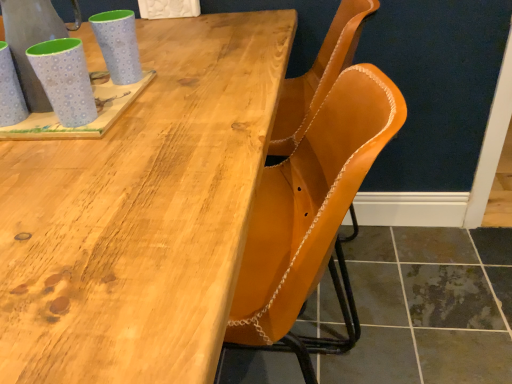
Identify the location of brushed metal pitcher at upper left. Image resolution: width=512 pixels, height=384 pixels. (33, 40).

What do you see at coordinates (311, 216) in the screenshot? The height and width of the screenshot is (384, 512). I see `leather at center` at bounding box center [311, 216].

At what (x,y) coordinates should I click in order to perform the action: click on matte blue mug at upper left, the 2th mug positioned from the right. Please return your answer as a coordinate pair (x, y). The width and height of the screenshot is (512, 384). Looking at the image, I should click on (65, 79).

In order to face matte blue mug at upper left, which ranks as the 1th mug in right-to-left order, should I rotate leftwards or rightwards?

You should look left and rotate roughly 17.838 degrees.

You are a GUI agent. You are given a task and a screenshot of the screen. Output one action in this format:
    pyautogui.click(x=<x>, y=<y>)
    Task: Click on the matte blue mug at left, acting as the 1th mug starting from the left
    This screenshot has height=384, width=512.
    Given the screenshot: What is the action you would take?
    tap(10, 91)

Locate an element on the screen. Image resolution: width=512 pixels, height=384 pixels. natural wood table at upper center is located at coordinates (142, 213).

Describe the element at coordinates (142, 213) in the screenshot. I see `natural wood table at upper center` at that location.

Identify the location of brushed metal pitcher at upper left. (33, 40).

Which of these two, matte blue mug at left, acting as the 1th mug starting from the left, or matte blue mug at upper left, the 2th mug positioned from the right, is wider?

With larger width is matte blue mug at left, acting as the 1th mug starting from the left.

From the image's perspective, which is above, matte blue mug at left, acting as the third mug starting from the right, or matte blue mug at upper left, the 2th mug positioned from the right?

From the image's view, matte blue mug at left, acting as the third mug starting from the right, is above.

Considering their positions, is matte blue mug at left, acting as the third mug starting from the right, located in front of or behind matte blue mug at upper left, marked as the second mug in a left-to-right arrangement?

Visually, matte blue mug at left, acting as the third mug starting from the right, is located behind matte blue mug at upper left, marked as the second mug in a left-to-right arrangement.

This screenshot has width=512, height=384. Find the location of `mug on the right of matte blue mug at upper left, the 2th mug positioned from the right`. mug on the right of matte blue mug at upper left, the 2th mug positioned from the right is located at coordinates (118, 44).

From the image's perspective, does matte blue mug at upper left, which is the 3th mug in left-to-right order, appear higher than matte blue mug at upper left, the 2th mug positioned from the right?

Yes, from the image's perspective, matte blue mug at upper left, which is the 3th mug in left-to-right order, is over matte blue mug at upper left, the 2th mug positioned from the right.

Considering the relative sizes of matte blue mug at upper left, which ranks as the 1th mug in right-to-left order, and matte blue mug at upper left, the 2th mug positioned from the right, in the image provided, is matte blue mug at upper left, which ranks as the 1th mug in right-to-left order, bigger than matte blue mug at upper left, the 2th mug positioned from the right,?

Yes, matte blue mug at upper left, which ranks as the 1th mug in right-to-left order, is bigger than matte blue mug at upper left, the 2th mug positioned from the right.

Is brushed metal pitcher at upper left smaller than natural wood table at upper center?

Yes, brushed metal pitcher at upper left is smaller than natural wood table at upper center.

Considering the sizes of brushed metal pitcher at upper left and natural wood table at upper center in the image, is brushed metal pitcher at upper left taller or shorter than natural wood table at upper center?

In the image, brushed metal pitcher at upper left appears to be shorter than natural wood table at upper center.

From the picture: From the image's perspective, is brushed metal pitcher at upper left located above or below natural wood table at upper center?

Clearly, from the image's perspective, brushed metal pitcher at upper left is above natural wood table at upper center.

Is the surface of brushed metal pitcher at upper left in direct contact with natural wood table at upper center?

No.

In the scene shown: Considering the sizes of objects matte blue mug at upper left, which ranks as the 1th mug in right-to-left order, and leather at center in the image provided, who is thinner, matte blue mug at upper left, which ranks as the 1th mug in right-to-left order, or leather at center?

Thinner between the two is matte blue mug at upper left, which ranks as the 1th mug in right-to-left order.

Is matte blue mug at upper left, which is the 3th mug in left-to-right order, surrounding leather at center?

No, leather at center is not a part of matte blue mug at upper left, which is the 3th mug in left-to-right order.

From the picture: Can you tell me how much matte blue mug at upper left, which ranks as the 1th mug in right-to-left order, and leather at center differ in facing direction?

The angle between the facing direction of matte blue mug at upper left, which ranks as the 1th mug in right-to-left order, and the facing direction of leather at center is 93.2 degrees.

From a real-world perspective, relative to leather at center, is matte blue mug at upper left, which ranks as the 1th mug in right-to-left order, vertically above or below?

matte blue mug at upper left, which ranks as the 1th mug in right-to-left order, is situated higher than leather at center in the real world.

Which object is more forward, natural wood table at upper center or matte blue mug at upper left, which is the 3th mug in left-to-right order?

natural wood table at upper center is closer to the camera.

Looking at this image, from the image's perspective, which one is positioned lower, natural wood table at upper center or matte blue mug at upper left, which is the 3th mug in left-to-right order?

natural wood table at upper center.

Is natural wood table at upper center inside the boundaries of matte blue mug at upper left, which is the 3th mug in left-to-right order, or outside?

The correct answer is: outside.

Is matte blue mug at left, acting as the third mug starting from the right, inside matte blue mug at upper left, marked as the second mug in a left-to-right arrangement?

No, matte blue mug at left, acting as the third mug starting from the right, is not inside matte blue mug at upper left, marked as the second mug in a left-to-right arrangement.

Does matte blue mug at upper left, the 2th mug positioned from the right, have a greater height compared to matte blue mug at left, acting as the 1th mug starting from the left?

No, matte blue mug at upper left, the 2th mug positioned from the right, is not taller than matte blue mug at left, acting as the 1th mug starting from the left.

Looking at this image, from the image's perspective, would you say matte blue mug at upper left, the 2th mug positioned from the right, is shown under matte blue mug at left, acting as the 1th mug starting from the left?

Yes, from the image's perspective, matte blue mug at upper left, the 2th mug positioned from the right, is beneath matte blue mug at left, acting as the 1th mug starting from the left.

Is matte blue mug at upper left, marked as the second mug in a left-to-right arrangement, positioned far away from matte blue mug at left, acting as the 1th mug starting from the left?

No, matte blue mug at upper left, marked as the second mug in a left-to-right arrangement, is not far away from matte blue mug at left, acting as the 1th mug starting from the left.

Considering the sizes of objects leather at center and natural wood table at upper center in the image provided, who is bigger, leather at center or natural wood table at upper center?

natural wood table at upper center.

From a real-world perspective, is leather at center beneath natural wood table at upper center?

Incorrect, from a real-world perspective, leather at center is higher than natural wood table at upper center.

Between leather at center and natural wood table at upper center, which one has larger width?

With larger width is natural wood table at upper center.

From a real-world perspective, starting from the matte blue mug at left, acting as the 1th mug starting from the left, which mug is the 2nd one below it? Please provide its 2D coordinates.

[(65, 79)]

Locate an element on the screen. The width and height of the screenshot is (512, 384). mug on the right of matte blue mug at upper left, marked as the second mug in a left-to-right arrangement is located at coordinates (118, 44).

From the image, which object appears to be nearer to matte blue mug at upper left, marked as the second mug in a left-to-right arrangement, brushed metal pitcher at upper left or matte blue mug at left, acting as the third mug starting from the right?

Among the two, brushed metal pitcher at upper left is located nearer to matte blue mug at upper left, marked as the second mug in a left-to-right arrangement.

Based on the photo, considering their positions, is natural wood table at upper center positioned further to leather at center than matte blue mug at upper left, which is the 3th mug in left-to-right order?

matte blue mug at upper left, which is the 3th mug in left-to-right order, is further to leather at center.

When comparing their distances from leather at center, does matte blue mug at left, acting as the third mug starting from the right, or brushed metal pitcher at upper left seem closer?

The object closer to leather at center is brushed metal pitcher at upper left.

Which object lies further to the anchor point brushed metal pitcher at upper left, leather at center or matte blue mug at upper left, marked as the second mug in a left-to-right arrangement?

Among the two, leather at center is located further to brushed metal pitcher at upper left.

From the image, which object appears to be farther from matte blue mug at upper left, which ranks as the 1th mug in right-to-left order, matte blue mug at upper left, marked as the second mug in a left-to-right arrangement, or brushed metal pitcher at upper left?

matte blue mug at upper left, marked as the second mug in a left-to-right arrangement, is positioned further to the anchor matte blue mug at upper left, which ranks as the 1th mug in right-to-left order.

Based on their spatial positions, is leather at center or brushed metal pitcher at upper left further from natural wood table at upper center?

brushed metal pitcher at upper left is positioned further to the anchor natural wood table at upper center.

When comparing their distances from leather at center, does matte blue mug at upper left, which is the 3th mug in left-to-right order, or natural wood table at upper center seem closer?

Based on the image, natural wood table at upper center appears to be nearer to leather at center.

From the image, which object appears to be farther from matte blue mug at upper left, marked as the second mug in a left-to-right arrangement, matte blue mug at upper left, which is the 3th mug in left-to-right order, or matte blue mug at left, acting as the 1th mug starting from the left?

Among the two, matte blue mug at upper left, which is the 3th mug in left-to-right order, is located further to matte blue mug at upper left, marked as the second mug in a left-to-right arrangement.

You are a GUI agent. You are given a task and a screenshot of the screen. Output one action in this format:
    pyautogui.click(x=<x>, y=<y>)
    Task: Click on the mug between matte blue mug at left, acting as the third mug starting from the right, and matte blue mug at upper left, which is the 3th mug in left-to-right order
    The width and height of the screenshot is (512, 384).
    Given the screenshot: What is the action you would take?
    pyautogui.click(x=65, y=79)

You are a GUI agent. You are given a task and a screenshot of the screen. Output one action in this format:
    pyautogui.click(x=<x>, y=<y>)
    Task: Click on the table between brushed metal pitcher at upper left and leather at center from left to right
    
    Given the screenshot: What is the action you would take?
    pyautogui.click(x=142, y=213)

At what (x,y) coordinates should I click in order to perform the action: click on gray between natural wood table at upper center and matte blue mug at upper left, which ranks as the 1th mug in right-to-left order, from front to back. Please return your answer as a coordinate pair (x, y). The image size is (512, 384). Looking at the image, I should click on (33, 40).

I want to click on gray between matte blue mug at upper left, the 2th mug positioned from the right, and matte blue mug at upper left, which is the 3th mug in left-to-right order, along the z-axis, so click(33, 40).